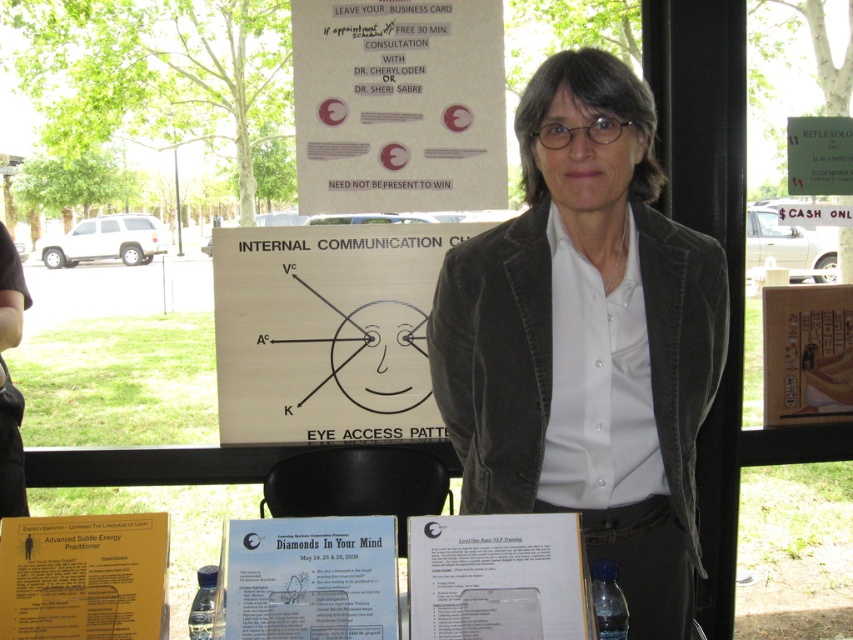
How much distance is there between white paper at center and yellow paper at lower left?

A distance of 18.53 inches exists between white paper at center and yellow paper at lower left.

Between white paper at center and yellow paper at lower left, which one is positioned higher?

white paper at center is higher up.

In order to click on white paper at center in this screenshot , I will do point(496,577).

Does matte black jacket at center have a smaller size compared to yellow paper at lower left?

Incorrect, matte black jacket at center is not smaller in size than yellow paper at lower left.

Is point (569, 333) farther from camera compared to point (54, 564)?

Yes, it is behind point (54, 564).

Between point (666, 602) and point (155, 592), which one is positioned behind?

Point (666, 602)

The height and width of the screenshot is (640, 853). What are the coordinates of `matte black jacket at center` in the screenshot? It's located at (585, 339).

Measure the distance between point (x=19, y=557) and camera.

The distance of point (x=19, y=557) from camera is 4.61 feet.

In order to click on yellow paper at lower left in this screenshot , I will do `click(84, 577)`.